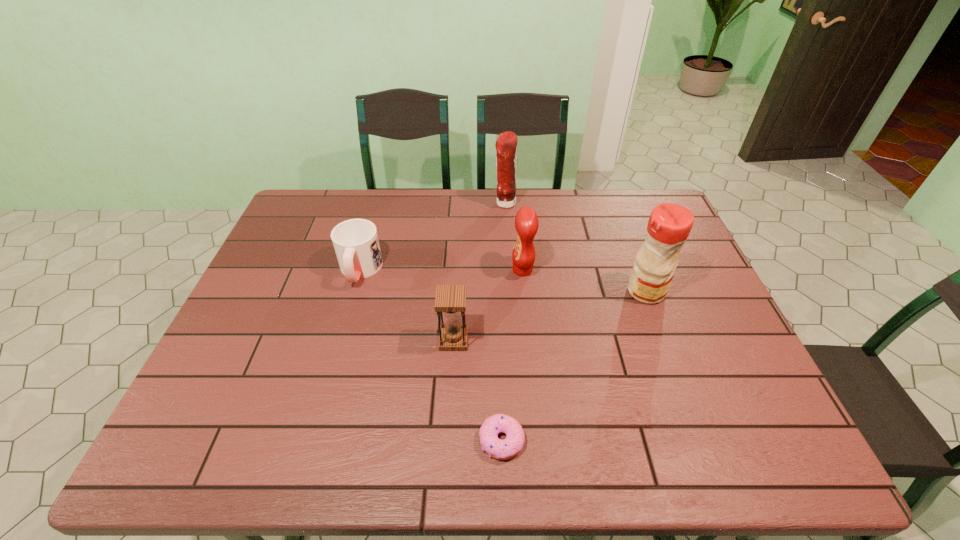
In order to click on free location located 0.120m on the left of the farthest condiment in this screenshot , I will do `click(460, 204)`.

This screenshot has height=540, width=960. I want to click on free spot located on the label side of the fourth shortest object, so click(x=410, y=270).

Locate an element on the screen. free space located 0.360m on the label side of the fourth shortest object is located at coordinates (390, 270).

Locate an element on the screen. The height and width of the screenshot is (540, 960). vacant space situated 0.130m on the label side of the fourth shortest object is located at coordinates (468, 270).

Find the location of a particular element. The width and height of the screenshot is (960, 540). vacant space positioned on the front of the hourglass is located at coordinates (447, 449).

Locate an element on the screen. The height and width of the screenshot is (540, 960). free location located on the side of the second shortest object with the handle is located at coordinates (344, 328).

You are a GUI agent. You are given a task and a screenshot of the screen. Output one action in this format:
    pyautogui.click(x=<x>, y=<y>)
    Task: Click on the free location located 0.350m on the right of the doughnut
    This screenshot has height=540, width=960.
    Given the screenshot: What is the action you would take?
    pyautogui.click(x=690, y=441)

Find the location of `object that is positioned at the far edge`. object that is positioned at the far edge is located at coordinates 506,145.

Locate an element on the screen. object that is at the near edge is located at coordinates (505, 449).

Find the location of a particular element. object that is at the right edge is located at coordinates (x=669, y=225).